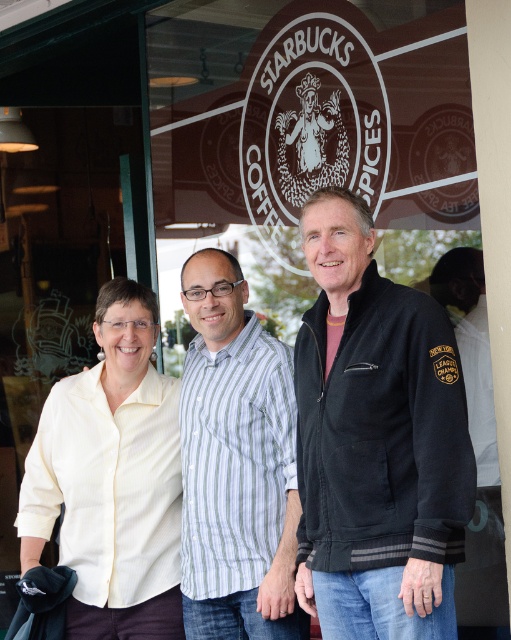
Question: Which point appears closest to the camera in this image?

Choices:
 (A) (264, 598)
 (B) (135, 284)
 (C) (433, 360)

Answer: (C)

Question: Can you confirm if black fleece jacket at center is wider than yellow striped shirt at center?

Choices:
 (A) yes
 (B) no

Answer: (B)

Question: Which object appears farthest from the camera in this image?

Choices:
 (A) yellow striped shirt at center
 (B) striped cotton shirt at center

Answer: (A)

Question: Which of the following is the farthest from the observer?

Choices:
 (A) striped cotton shirt at center
 (B) yellow striped shirt at center
 (C) black fleece jacket at center

Answer: (B)

Question: Considering the relative positions of yellow striped shirt at center and striped cotton shirt at center in the image provided, where is yellow striped shirt at center located with respect to striped cotton shirt at center?

Choices:
 (A) right
 (B) left

Answer: (B)

Question: Does black fleece jacket at center appear under striped cotton shirt at center?

Choices:
 (A) no
 (B) yes

Answer: (A)